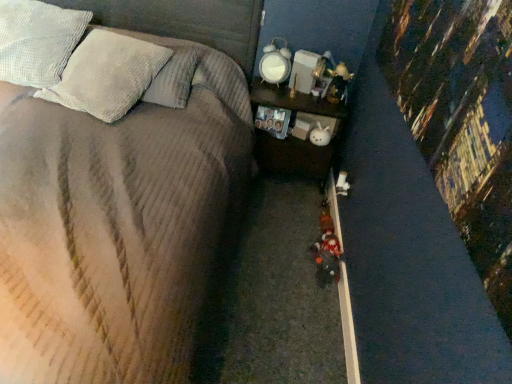
Question: Are plush fabric toy at center and white textured pillow at upper left, acting as the 1th pillow starting from the right, making contact?

Choices:
 (A) no
 (B) yes

Answer: (A)

Question: Is plush fabric toy at center outside of white textured pillow at upper left, acting as the 1th pillow starting from the right?

Choices:
 (A) no
 (B) yes

Answer: (B)

Question: From a real-world perspective, does plush fabric toy at center sit lower than white textured pillow at upper left, acting as the 1th pillow starting from the right?

Choices:
 (A) no
 (B) yes

Answer: (B)

Question: Is the position of plush fabric toy at center less distant than that of white textured pillow at upper left, which is the second pillow in left-to-right order?

Choices:
 (A) no
 (B) yes

Answer: (A)

Question: Is plush fabric toy at center to the left of white textured pillow at upper left, acting as the 1th pillow starting from the right, from the viewer's perspective?

Choices:
 (A) no
 (B) yes

Answer: (A)

Question: Is plush fabric toy at center bigger than white textured pillow at upper left, acting as the 1th pillow starting from the right?

Choices:
 (A) yes
 (B) no

Answer: (B)

Question: Would you say white textured pillow at upper left, positioned as the 2th pillow in right-to-left order, is part of plush fabric toy at center's contents?

Choices:
 (A) no
 (B) yes

Answer: (A)

Question: Considering the relative sizes of plush fabric toy at center and white textured pillow at upper left, which is counted as the first pillow, starting from the left, in the image provided, is plush fabric toy at center shorter than white textured pillow at upper left, which is counted as the first pillow, starting from the left,?

Choices:
 (A) yes
 (B) no

Answer: (A)

Question: Is plush fabric toy at center positioned with its back to white textured pillow at upper left, positioned as the 2th pillow in right-to-left order?

Choices:
 (A) yes
 (B) no

Answer: (B)

Question: Considering the relative positions of plush fabric toy at center and white textured pillow at upper left, positioned as the 2th pillow in right-to-left order, in the image provided, is plush fabric toy at center to the left of white textured pillow at upper left, positioned as the 2th pillow in right-to-left order, from the viewer's perspective?

Choices:
 (A) no
 (B) yes

Answer: (A)

Question: Does plush fabric toy at center have a greater width compared to white textured pillow at upper left, positioned as the 2th pillow in right-to-left order?

Choices:
 (A) yes
 (B) no

Answer: (B)

Question: From the image's perspective, is plush fabric toy at center over white textured pillow at upper left, positioned as the 2th pillow in right-to-left order?

Choices:
 (A) yes
 (B) no

Answer: (B)

Question: Is corduroy fabric bed at center turned away from wooden nightstand at center?

Choices:
 (A) yes
 (B) no

Answer: (B)